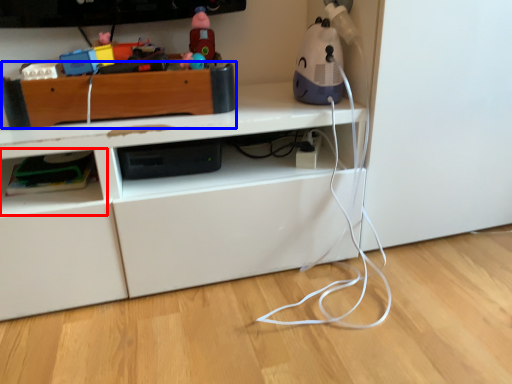
Question: Which object appears closest to the camera in this image, shelf (highlighted by a red box) or shelf (highlighted by a blue box)?

Choices:
 (A) shelf
 (B) shelf

Answer: (B)